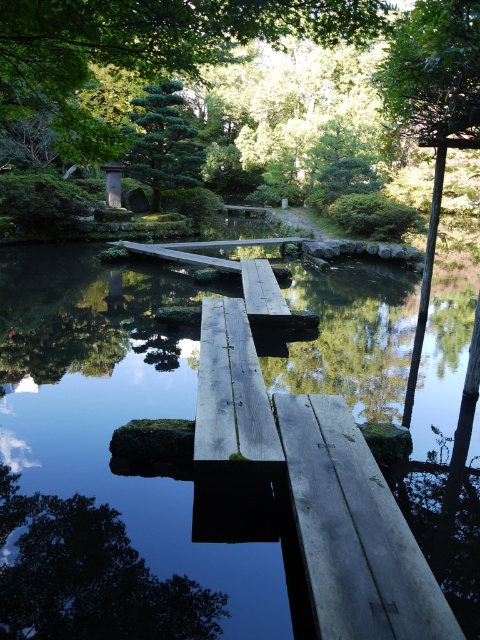
Question: Among these objects, which one is farthest from the camera?

Choices:
 (A) green matte tree at lower left
 (B) wooden plank at center

Answer: (B)

Question: Can you confirm if green matte tree at upper right is positioned above green matte tree at upper left?

Choices:
 (A) no
 (B) yes

Answer: (A)

Question: Which object is farther from the camera taking this photo?

Choices:
 (A) wooden plank at center
 (B) green matte tree at upper left
 (C) green matte tree at upper right

Answer: (B)

Question: In this image, where is green matte tree at lower left located relative to green matte tree at upper left?

Choices:
 (A) right
 (B) left

Answer: (A)

Question: Does green matte tree at upper right appear on the left side of wooden plank at center?

Choices:
 (A) no
 (B) yes

Answer: (A)

Question: Which point appears farthest from the camera in this image?

Choices:
 (A) (132, 120)
 (B) (216, 616)
 (C) (264, 276)

Answer: (A)